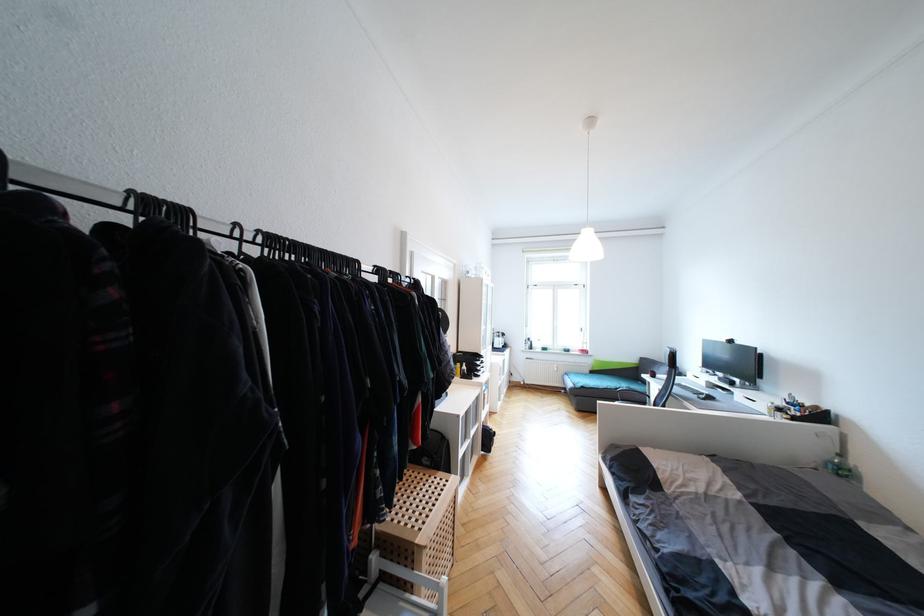
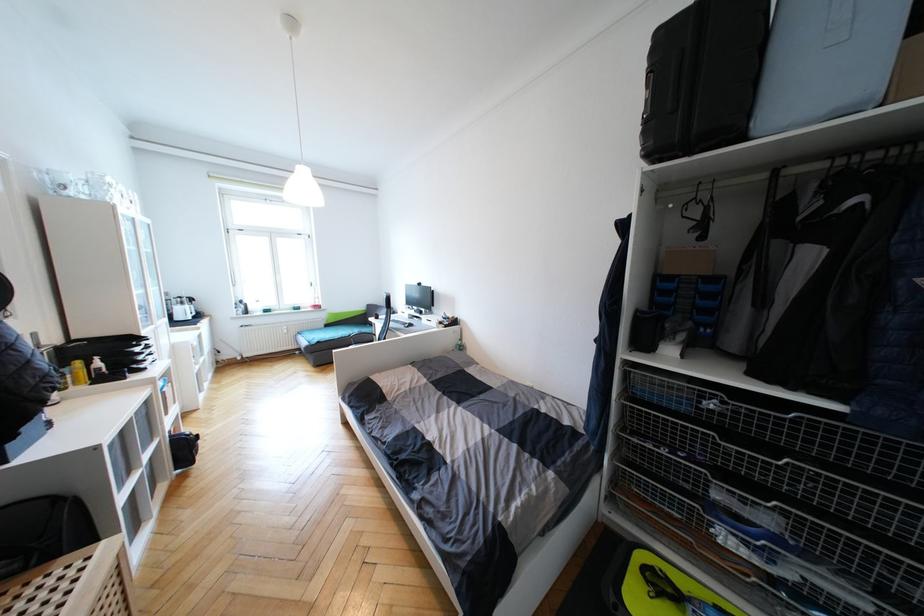
In the second image, find the point that corresponds to [462,366] in the first image.

(81, 363)